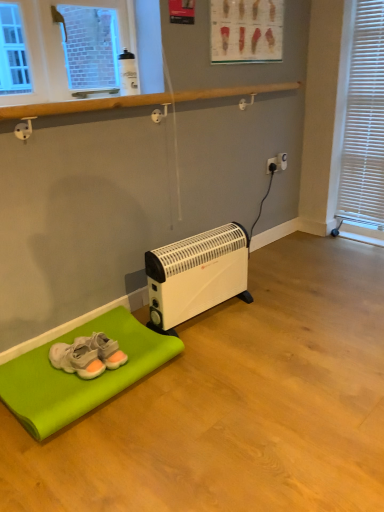
You are a GUI agent. You are given a task and a screenshot of the screen. Output one action in this format:
    pyautogui.click(x=<x>, y=<y>)
    Task: Click on the free space in front of green fabric mat at lower left
    The height and width of the screenshot is (512, 384).
    Given the screenshot: What is the action you would take?
    tap(108, 457)